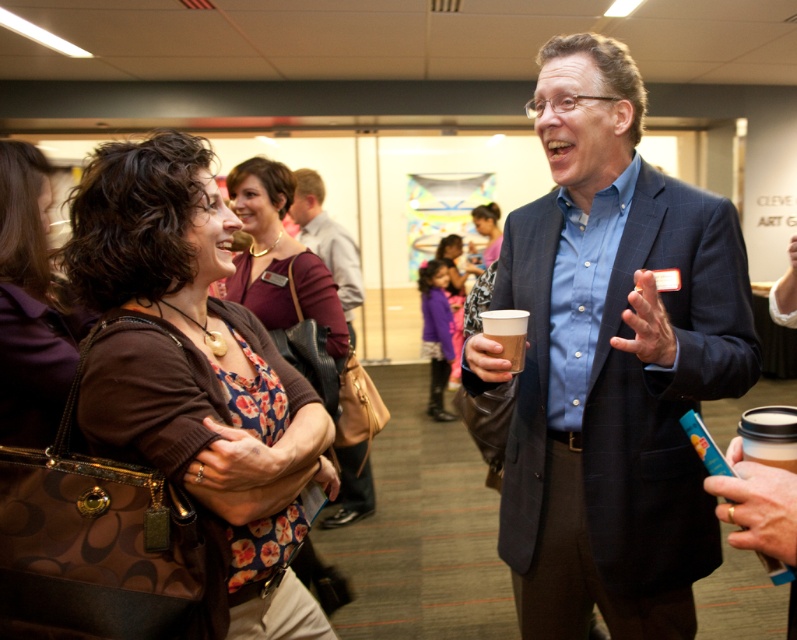
You are at a networking event and see two people in the center of the image. The woman is wearing a floral fabric dress at center and a purple fuzzy coat at center. Which clothing item is positioned higher on her body?

The floral fabric dress at center is located above the purple fuzzy coat at center, so the dress is positioned higher on her body.

You are a photographer at the event and want to take a photo that includes both the brown leather purse at upper left and the purple fuzzy coat at center. The camera has a maximum focus range of 12 feet. Will both objects be in focus?

→ The brown leather purse at upper left is 12.44 feet from the purple fuzzy coat at center. Since the distance between them exceeds the camera maximum focus range of 12 feet, the camera cannot focus on both objects simultaneously.

You are taking a photo of the two points in the image. Which point, point (273, 416) or point (450, 348), will appear larger in your photo?

Point (273, 416) is closer to the camera than point (450, 348), so it will appear larger in the photo.